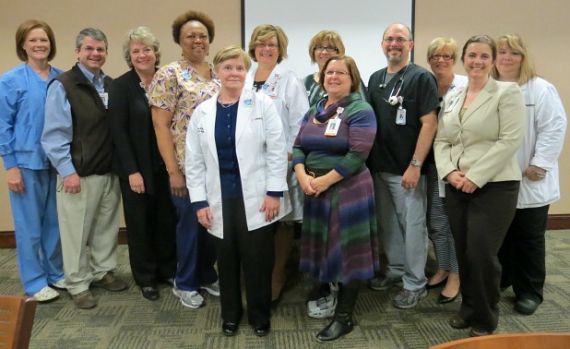
You are a GUI agent. You are given a task and a screenshot of the screen. Output one action in this format:
    pyautogui.click(x=<x>, y=<y>)
    Task: Click on the projector screen
    The width and height of the screenshot is (570, 349).
    Given the screenshot: What is the action you would take?
    pyautogui.click(x=313, y=12)